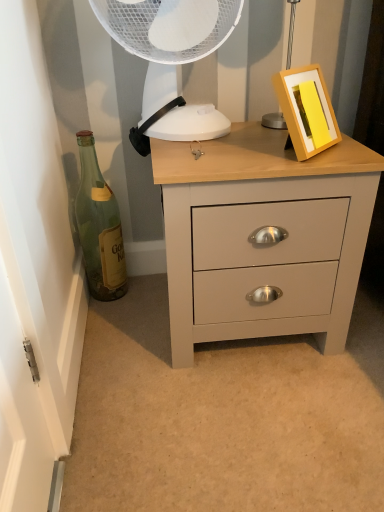
Locate an element on the screen. The height and width of the screenshot is (512, 384). free space on the front side of matte gray chest of drawers at center is located at coordinates (241, 423).